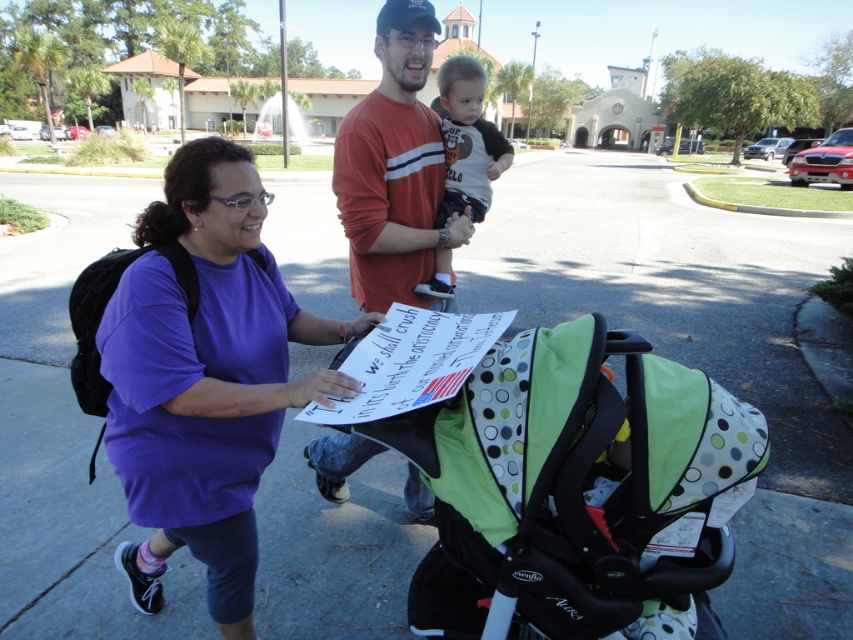
You are a photographer standing at the edge of the sidewalk. You want to take a photo that includes both the green polka dot fabric baby carriage at center and the orange cotton shirt at center. Given their distance apart, will they both fit in the frame if your camera has a 4.5 feet wide field of view?

The green polka dot fabric baby carriage at center and orange cotton shirt at center are 4.71 feet apart. Since the distance between them exceeds the camera frame width of 4.5 feet, they won not both fit in the frame.

Based on the scene description, what are the coordinates of the green polka dot fabric baby carriage at center?

The green polka dot fabric baby carriage at center is located at coordinates point (573, 488).

Based on the coordinates provided, what object is located at point [573,488] in the image?

The point [573,488] indicates the location of the green polka dot fabric baby carriage at center.